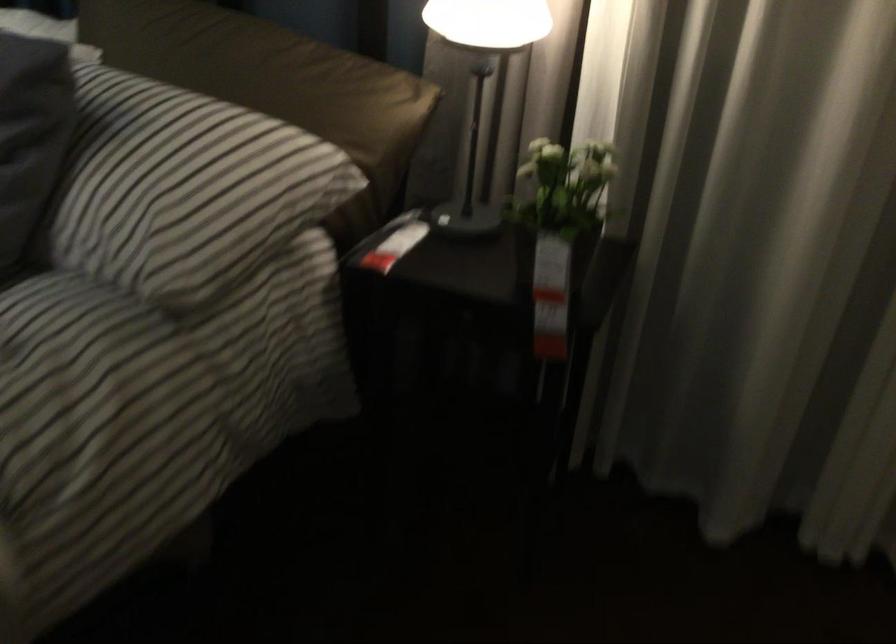
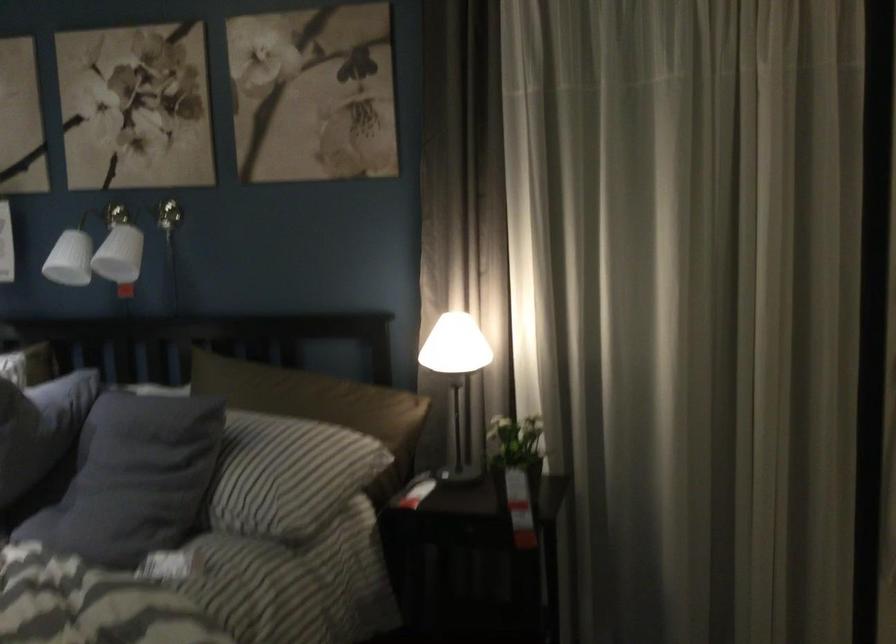
Find the pixel in the second image that matches pixel 556 207 in the first image.

(515, 451)